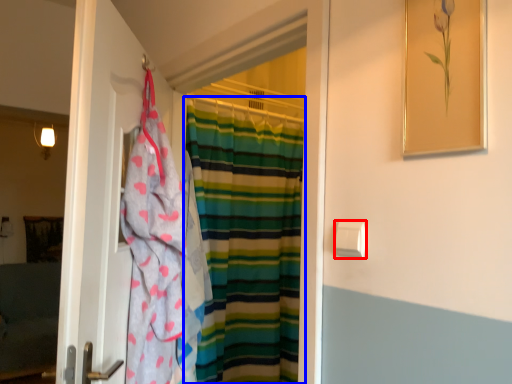
Question: Which of the following is the closest to the observer, towel bar (highlighted by a red box) or curtain (highlighted by a blue box)?

Choices:
 (A) towel bar
 (B) curtain

Answer: (A)